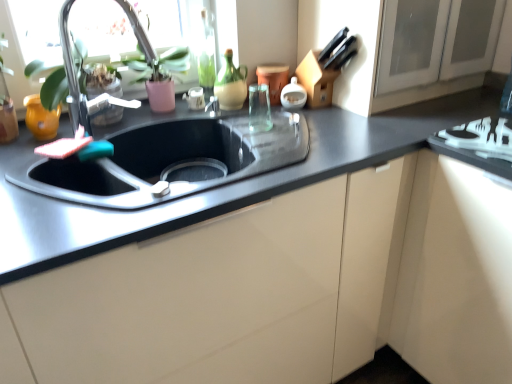
Question: Is matte yellow vase at left, arranged as the fourth appliance when viewed from the right, in front of matte white cabinet at center?

Choices:
 (A) yes
 (B) no

Answer: (B)

Question: From a real-world perspective, is matte yellow vase at left, arranged as the fourth appliance when viewed from the right, over matte white cabinet at center?

Choices:
 (A) yes
 (B) no

Answer: (A)

Question: Considering the relative sizes of matte yellow vase at left, arranged as the fourth appliance when viewed from the right, and matte white cabinet at center in the image provided, is matte yellow vase at left, arranged as the fourth appliance when viewed from the right, wider than matte white cabinet at center?

Choices:
 (A) yes
 (B) no

Answer: (B)

Question: Does matte yellow vase at left, marked as the 1th appliance in a left-to-right arrangement, touch matte white cabinet at center?

Choices:
 (A) no
 (B) yes

Answer: (A)

Question: Is matte yellow vase at left, arranged as the fourth appliance when viewed from the right, at the left side of matte white cabinet at center?

Choices:
 (A) yes
 (B) no

Answer: (A)

Question: Is matte yellow vase at left, arranged as the fourth appliance when viewed from the right, outside matte white cabinet at center?

Choices:
 (A) yes
 (B) no

Answer: (A)

Question: Is black granite countertop at center in front of white glossy soap dispenser at upper center, acting as the 1th appliance starting from the right?

Choices:
 (A) yes
 (B) no

Answer: (A)

Question: Considering the relative sizes of black granite countertop at center and white glossy soap dispenser at upper center, acting as the 1th appliance starting from the right, in the image provided, is black granite countertop at center wider than white glossy soap dispenser at upper center, acting as the 1th appliance starting from the right,?

Choices:
 (A) yes
 (B) no

Answer: (A)

Question: From a real-world perspective, is black granite countertop at center located beneath white glossy soap dispenser at upper center, acting as the 1th appliance starting from the right?

Choices:
 (A) no
 (B) yes

Answer: (B)

Question: Can you confirm if black granite countertop at center is taller than white glossy soap dispenser at upper center, which is the 4th appliance from left to right?

Choices:
 (A) yes
 (B) no

Answer: (A)

Question: Can you confirm if black granite countertop at center is positioned to the left of white glossy soap dispenser at upper center, which is the 4th appliance from left to right?

Choices:
 (A) yes
 (B) no

Answer: (A)

Question: Can white glossy soap dispenser at upper center, acting as the 1th appliance starting from the right, be found inside black granite countertop at center?

Choices:
 (A) no
 (B) yes

Answer: (A)

Question: From the image's perspective, would you say black granite countertop at center is positioned over matte white cabinet at center?

Choices:
 (A) yes
 (B) no

Answer: (A)